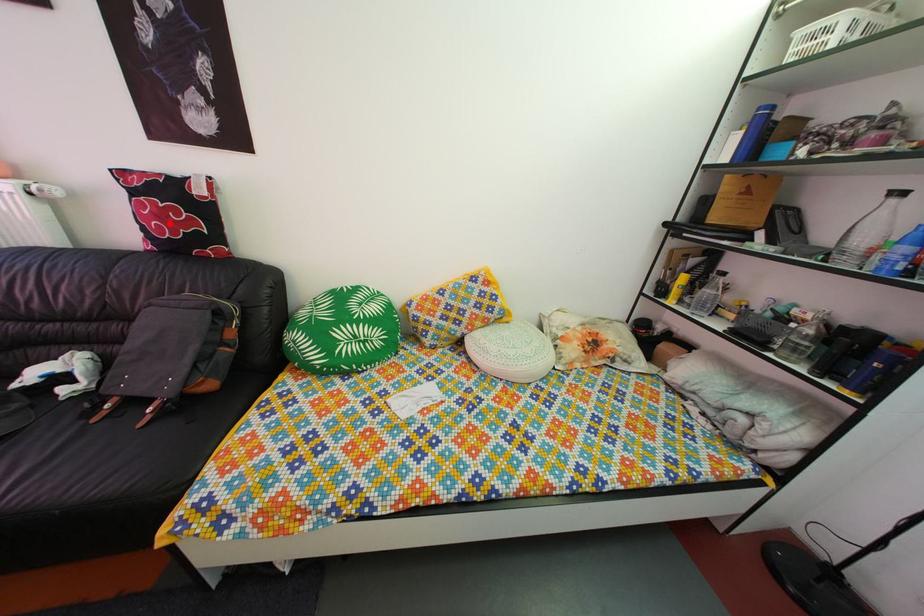
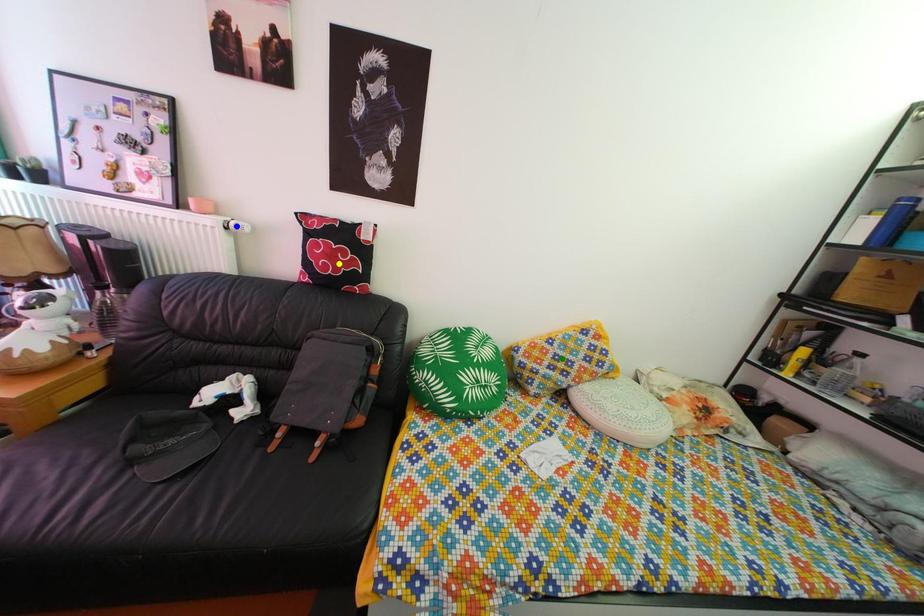
Question: I am providing you with two images of the same scene from different viewpoints. A red point is marked on the first image. You are given multiple points on the second image. Can you choose the point in image 2 that corresponds to the point in image 1?

Choices:
 (A) blue point
 (B) green point
 (C) yellow point

Answer: (C)